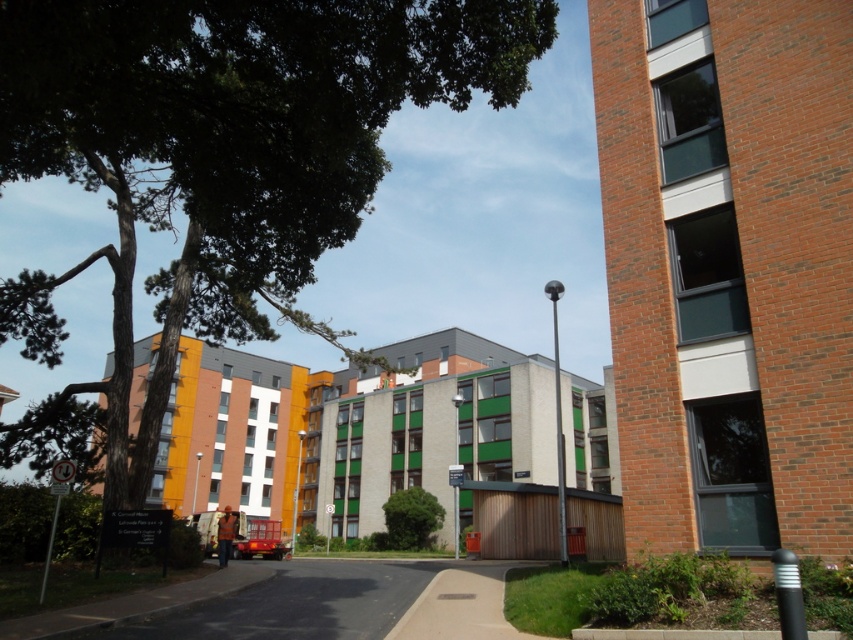
You are standing at the entrance of the residential area and want to locate the green leafy tree at upper left. According to the coordinates provided, where should you look to find it?

The green leafy tree at upper left is located at coordinates point (222, 156), which is in the upper left area of the image.

You are standing at the point marked by the coordinates point (222, 156) in the image. Looking around, you see the green leafy tree at upper left. Which direction should you walk to reach the closest building?

The point (222, 156) is marked at the green leafy tree at upper left. Since the closest building is the tall red brick structure with large windows in the foreground, you should walk towards the direction of that building to reach the closest building.